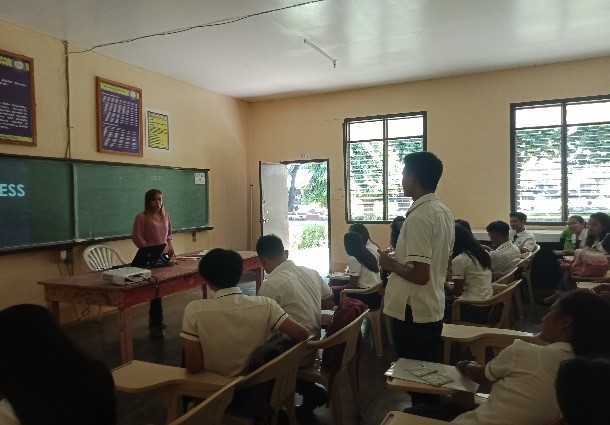
Find the location of a particular element. The height and width of the screenshot is (425, 610). poster is located at coordinates (131, 133).